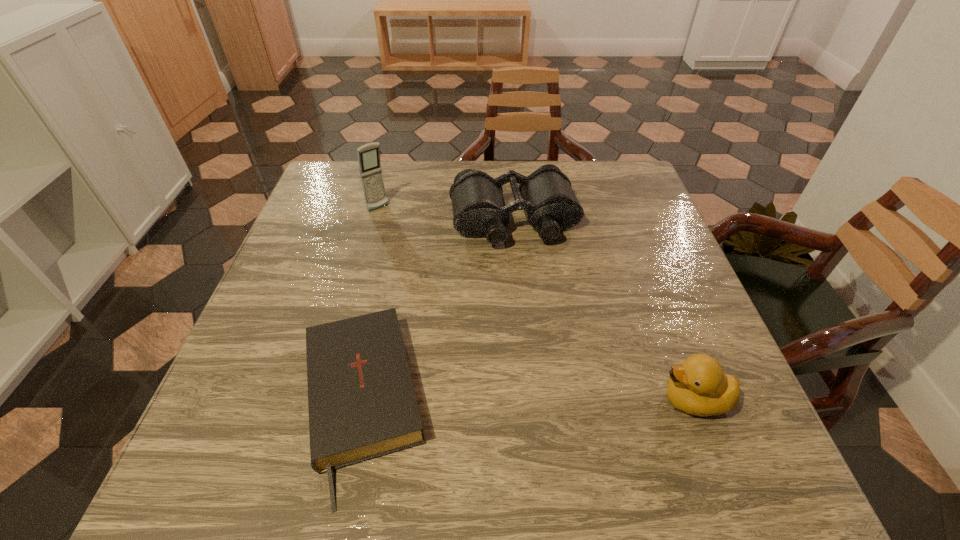
The height and width of the screenshot is (540, 960). I want to click on the shortest object, so click(x=362, y=405).

Find the location of `duckling`. duckling is located at coordinates [x=698, y=386].

Find the location of a particular element. The image size is (960, 540). cellular telephone is located at coordinates (370, 168).

You are a GUI agent. You are given a task and a screenshot of the screen. Output one action in this format:
    pyautogui.click(x=<x>, y=<y>)
    Task: Click on the binoculars
    
    Given the screenshot: What is the action you would take?
    pyautogui.click(x=479, y=210)

The height and width of the screenshot is (540, 960). I want to click on free space located on the left of the Bible, so click(235, 404).

The width and height of the screenshot is (960, 540). What are the coordinates of `blank space located facing forward on the duckling` in the screenshot? It's located at (468, 400).

The height and width of the screenshot is (540, 960). Find the location of `vacant area situated 0.360m facing forward on the duckling`. vacant area situated 0.360m facing forward on the duckling is located at coordinates (457, 400).

At what (x,y) coordinates should I click in order to perform the action: click on vacant area situated facing forward on the duckling. Please return your answer as a coordinate pair (x, y). This screenshot has width=960, height=540. Looking at the image, I should click on (473, 400).

This screenshot has width=960, height=540. In order to click on vacant space situated on the front-facing side of the cellular telephone in this screenshot , I will do `click(402, 234)`.

The width and height of the screenshot is (960, 540). I want to click on free region located 0.390m on the front-facing side of the cellular telephone, so click(461, 302).